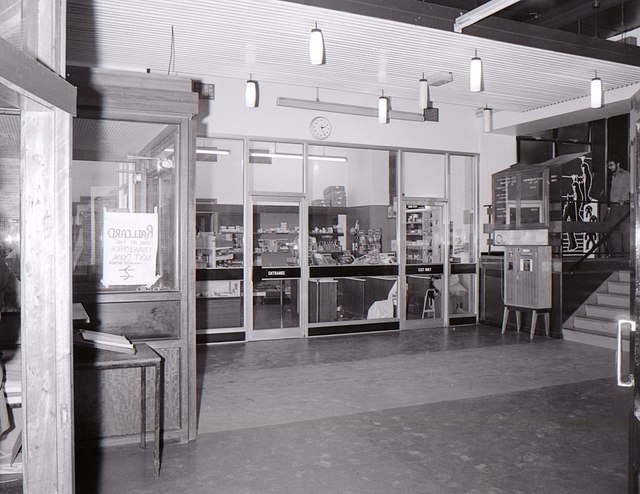
This screenshot has height=494, width=640. Identify the location of floor. (451, 391).